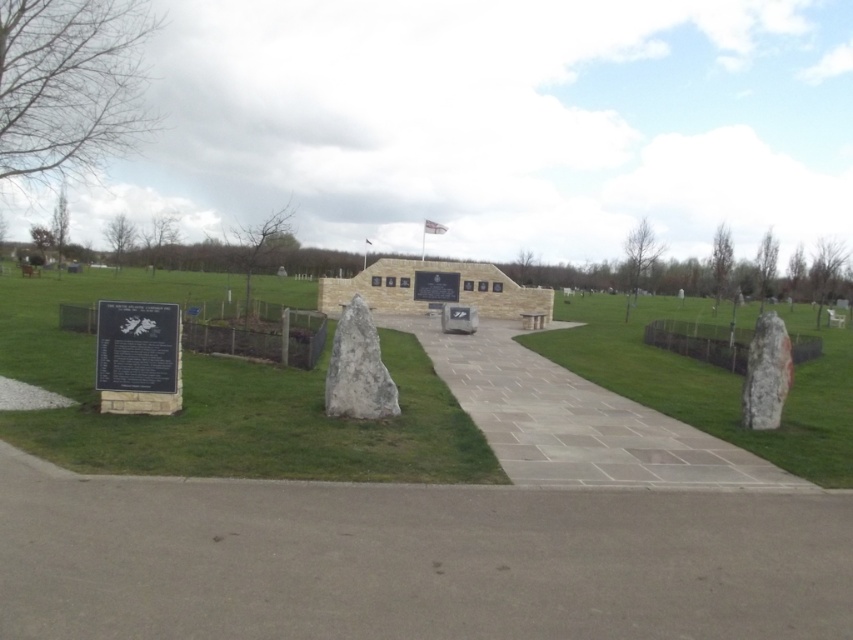
Question: Can you confirm if green grass at center is wider than gray stone path at center?

Choices:
 (A) no
 (B) yes

Answer: (B)

Question: Does green grass at center have a lesser width compared to gray stone at center?

Choices:
 (A) no
 (B) yes

Answer: (A)

Question: Which is farther from the gray concrete path at center?

Choices:
 (A) white textured stone at right
 (B) green grass at center

Answer: (B)

Question: Among these points, which one is nearest to the camera?

Choices:
 (A) (515, 342)
 (B) (332, 365)

Answer: (B)

Question: Where is gray concrete path at center located in relation to gray stone path at center in the image?

Choices:
 (A) left
 (B) right

Answer: (A)

Question: Considering the real-world distances, which object is farthest from the gray concrete path at center?

Choices:
 (A) green grass at center
 (B) gray stone at center
 (C) gray stone path at center

Answer: (A)